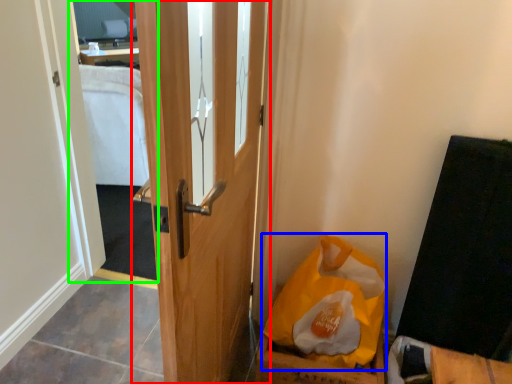
Question: Which object is the closest to the door (highlighted by a red box)? Choose among these: paper bag (highlighted by a blue box) or mirror (highlighted by a green box).

Choices:
 (A) paper bag
 (B) mirror

Answer: (A)